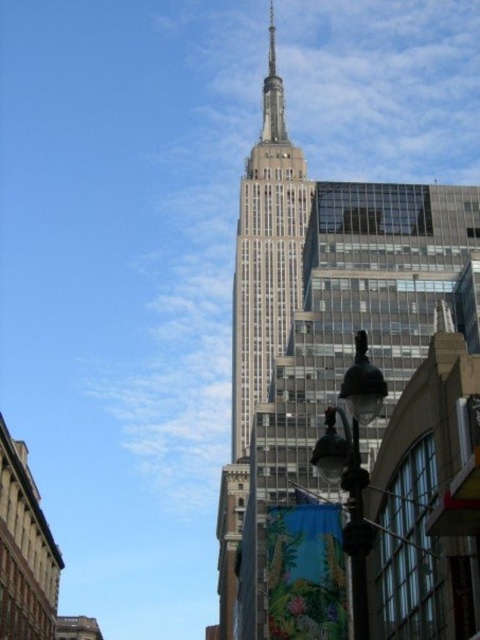
Question: In this image, where is white stone tower at center located relative to polished steel spire at center?

Choices:
 (A) above
 (B) below

Answer: (B)

Question: Which object is farther from the camera taking this photo?

Choices:
 (A) polished steel spire at center
 (B) white glass skyscraper at center

Answer: (A)

Question: Does white glass skyscraper at center have a smaller size compared to white stone tower at center?

Choices:
 (A) no
 (B) yes

Answer: (A)

Question: Which of the following is the closest to the observer?

Choices:
 (A) click(217, 584)
 (B) click(256, 396)
 (C) click(266, 90)

Answer: (B)

Question: Where is white stone tower at center located in relation to polished steel spire at center in the image?

Choices:
 (A) above
 (B) below

Answer: (B)

Question: Which point is farther from the camera taking this photo?

Choices:
 (A) (303, 337)
 (B) (277, 109)
 (C) (264, 284)

Answer: (B)